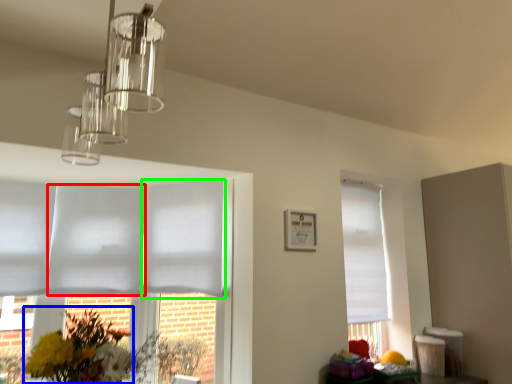
Question: Which is nearer to the blind (highlighted by a red box)? floral arrangement (highlighted by a blue box) or blind (highlighted by a green box).

Choices:
 (A) floral arrangement
 (B) blind

Answer: (B)